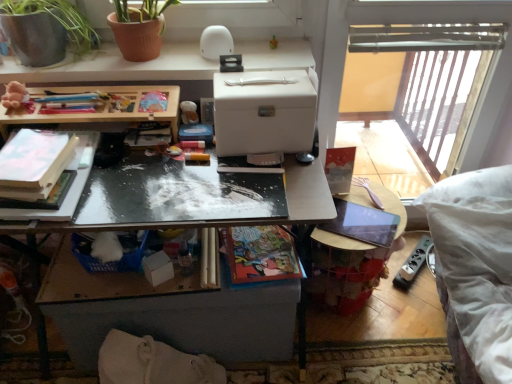
Identify the location of free space above white matte desk at upper center (from a real-world perspective). (154, 56).